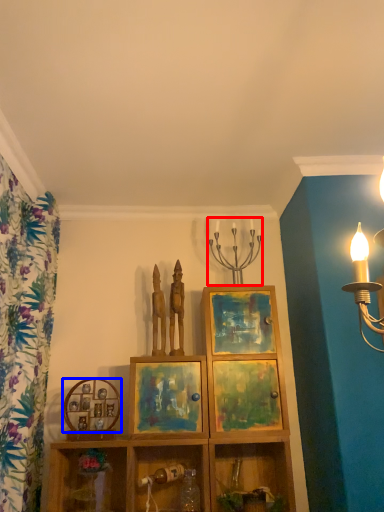
Question: Which object appears closest to the camera in this image, candle holder (highlighted by a red box) or picture frame (highlighted by a blue box)?

Choices:
 (A) candle holder
 (B) picture frame

Answer: (B)